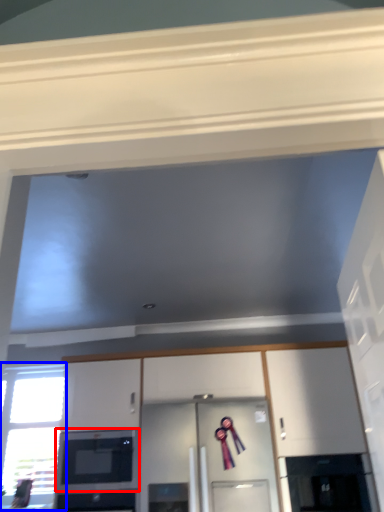
Question: Which of the following is the farthest to the observer, microwave oven (highlighted by a red box) or window (highlighted by a blue box)?

Choices:
 (A) microwave oven
 (B) window

Answer: (B)